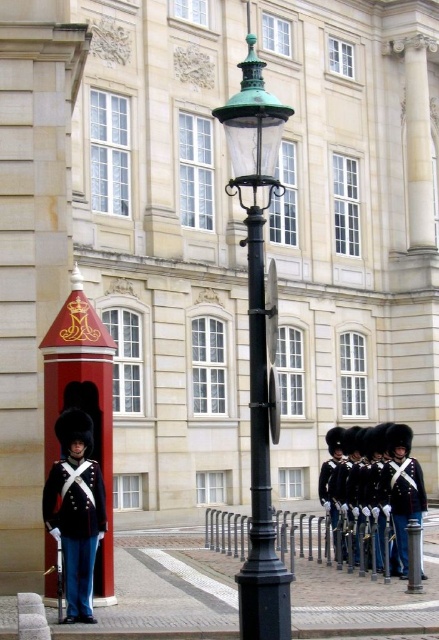
Question: Does green glass lamp post at center have a larger size compared to shiny black uniform at center?

Choices:
 (A) no
 (B) yes

Answer: (B)

Question: Which object appears closest to the camera in this image?

Choices:
 (A) shiny black uniform at center
 (B) black glossy uniform at center
 (C) green glass lamp post at center
 (D) shiny blue fabric uniform at center

Answer: (C)

Question: Which point is closer to the camera?

Choices:
 (A) (399, 456)
 (B) (87, 522)
 (C) (259, 440)
 (D) (392, 452)

Answer: (C)

Question: Is green glass lamp post at center below black glossy uniform at center?

Choices:
 (A) yes
 (B) no

Answer: (B)

Question: Can you confirm if black metal pole at center is positioned below shiny black uniform at left?

Choices:
 (A) yes
 (B) no

Answer: (B)

Question: Estimate the real-world distances between objects in this image. Which object is farther from the shiny black uniform at center?

Choices:
 (A) shiny blue fabric uniform at center
 (B) green glass lamp post at center
 (C) black metal pole at center

Answer: (B)